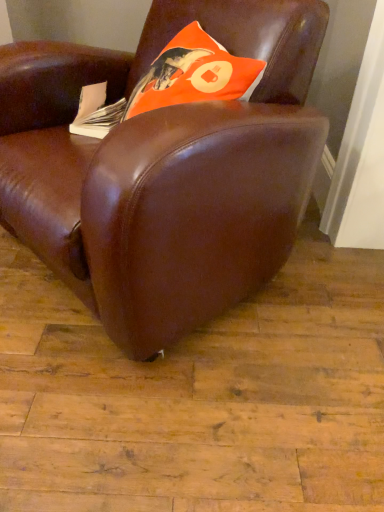
Question: Is the depth of white paper at left less than that of orange matte pillow at upper center?

Choices:
 (A) no
 (B) yes

Answer: (A)

Question: Can we say white paper at left lies outside orange matte pillow at upper center?

Choices:
 (A) no
 (B) yes

Answer: (B)

Question: From a real-world perspective, is white paper at left on top of orange matte pillow at upper center?

Choices:
 (A) no
 (B) yes

Answer: (A)

Question: Is white paper at left at the left side of orange matte pillow at upper center?

Choices:
 (A) no
 (B) yes

Answer: (B)

Question: Is the position of white paper at left more distant than that of orange matte pillow at upper center?

Choices:
 (A) yes
 (B) no

Answer: (A)

Question: In terms of size, does white paper at left appear bigger or smaller than orange matte pillow at upper center?

Choices:
 (A) big
 (B) small

Answer: (B)

Question: In the image, is white paper at left positioned in front of or behind orange matte pillow at upper center?

Choices:
 (A) front
 (B) behind

Answer: (B)

Question: Looking at their shapes, would you say white paper at left is wider or thinner than orange matte pillow at upper center?

Choices:
 (A) wide
 (B) thin

Answer: (B)

Question: From a real-world perspective, is white paper at left physically located above or below orange matte pillow at upper center?

Choices:
 (A) above
 (B) below

Answer: (B)

Question: Is brown leather chair at center in front of or behind white paper at left in the image?

Choices:
 (A) front
 (B) behind

Answer: (A)

Question: In terms of size, does brown leather chair at center appear bigger or smaller than white paper at left?

Choices:
 (A) big
 (B) small

Answer: (A)

Question: From a real-world perspective, is brown leather chair at center physically located above or below white paper at left?

Choices:
 (A) above
 (B) below

Answer: (B)

Question: Is brown leather chair at center wider or thinner than white paper at left?

Choices:
 (A) thin
 (B) wide

Answer: (B)

Question: From a real-world perspective, is white paper at left above or below brown leather chair at center?

Choices:
 (A) below
 (B) above

Answer: (B)

Question: Is white paper at left taller or shorter than brown leather chair at center?

Choices:
 (A) tall
 (B) short

Answer: (B)